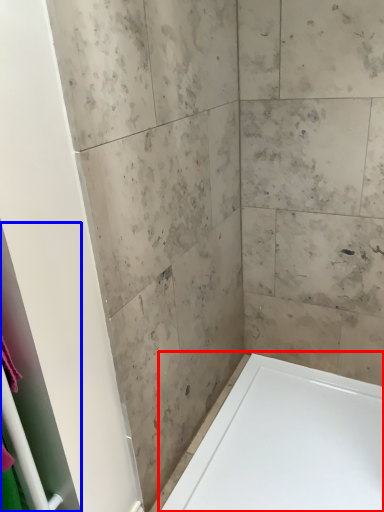
Question: Which point is closer to the camera, bathtub (highlighted by a red box) or screen door (highlighted by a blue box)?

Choices:
 (A) bathtub
 (B) screen door

Answer: (B)